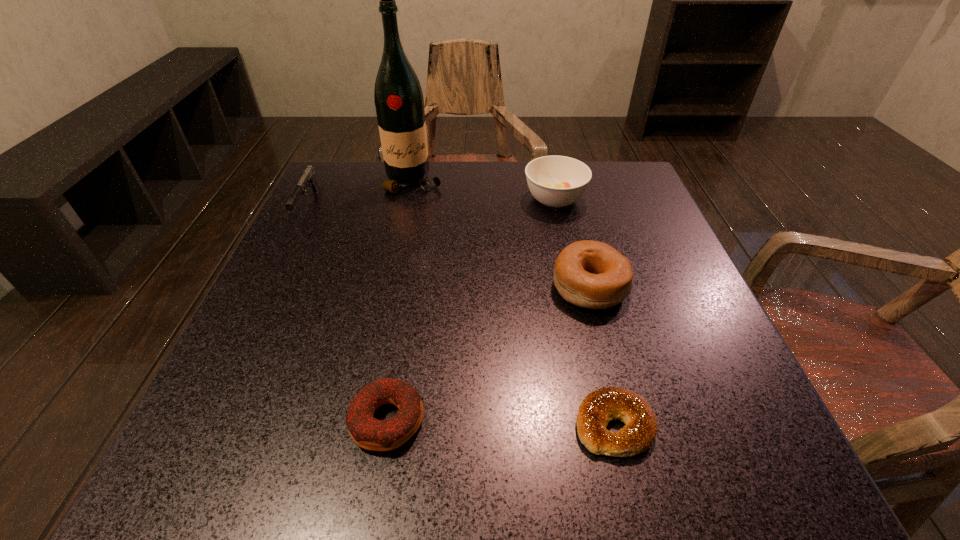
Locate an element on the screen. Image resolution: width=960 pixels, height=540 pixels. the fifth closest object relative to the shortest object is located at coordinates pyautogui.click(x=308, y=177).

Locate an element on the screen. The width and height of the screenshot is (960, 540). the third closest object to the fifth tallest object is located at coordinates (308, 177).

Locate an element on the screen. The width and height of the screenshot is (960, 540). free space that satisfies the following two spatial constraints: 1. at the muzzle end of the gun; 2. on the right side of the fourth farthest object is located at coordinates (267, 287).

Locate an element on the screen. Image resolution: width=960 pixels, height=540 pixels. free space that satisfies the following two spatial constraints: 1. on the front side of the tallest object; 2. on the left side of the soup bowl is located at coordinates (411, 199).

Image resolution: width=960 pixels, height=540 pixels. I want to click on free space in the image that satisfies the following two spatial constraints: 1. at the muzzle end of the gun; 2. on the left side of the doughnut, so click(201, 420).